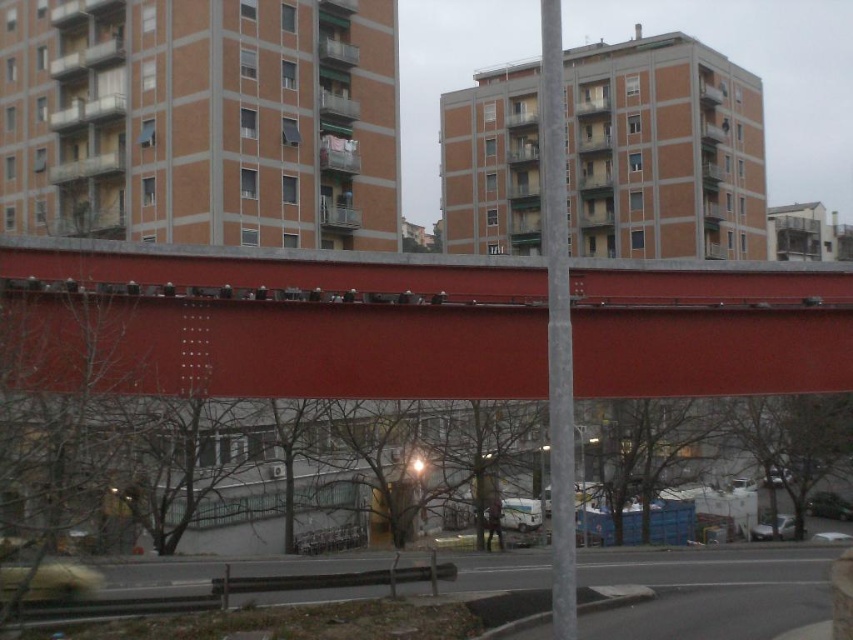
Question: Can you confirm if smooth red bridge at center is positioned to the left of gray concrete pole at center?

Choices:
 (A) no
 (B) yes

Answer: (B)

Question: Which object is closer to the camera taking this photo?

Choices:
 (A) dark brown leather jacket at center
 (B) gray concrete pole at center
 (C) smooth red bridge at center

Answer: (B)

Question: Is smooth red bridge at center bigger than gray concrete pole at center?

Choices:
 (A) yes
 (B) no

Answer: (B)

Question: Does smooth red bridge at center appear on the right side of gray concrete pole at center?

Choices:
 (A) no
 (B) yes

Answer: (A)

Question: Which of the following is the closest to the observer?

Choices:
 (A) dark brown leather jacket at center
 (B) gray concrete pole at center
 (C) smooth red bridge at center

Answer: (B)

Question: Which object is positioned farthest from the gray concrete pole at center?

Choices:
 (A) dark brown leather jacket at center
 (B) smooth red bridge at center

Answer: (A)